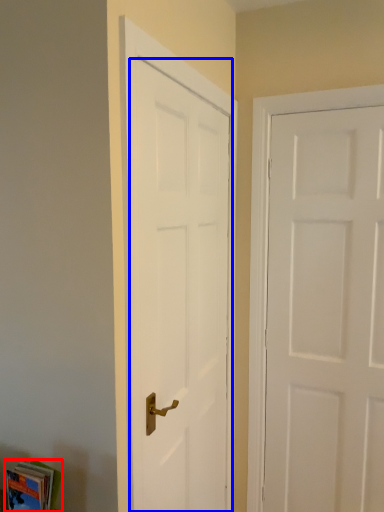
Question: Which object appears closest to the camera in this image, book (highlighted by a red box) or door (highlighted by a blue box)?

Choices:
 (A) book
 (B) door

Answer: (A)